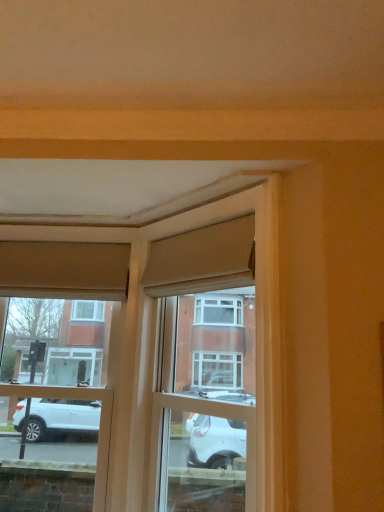
Question: Is matte wood window frame at center a part of matte glass window at center?

Choices:
 (A) yes
 (B) no

Answer: (B)

Question: Considering the relative sizes of matte glass window at center and matte wood window frame at center in the image provided, is matte glass window at center thinner than matte wood window frame at center?

Choices:
 (A) yes
 (B) no

Answer: (A)

Question: Is matte glass window at center touching matte wood window frame at center?

Choices:
 (A) no
 (B) yes

Answer: (A)

Question: Can you confirm if matte glass window at center is taller than matte wood window frame at center?

Choices:
 (A) no
 (B) yes

Answer: (B)

Question: Are matte glass window at center and matte wood window frame at center located far from each other?

Choices:
 (A) no
 (B) yes

Answer: (A)

Question: From the image's perspective, does matte glass window at center appear higher than matte wood window frame at center?

Choices:
 (A) no
 (B) yes

Answer: (A)

Question: Is matte wood window frame at center bigger than matte beige curtain at upper center, which is counted as the second curtain, starting from the back?

Choices:
 (A) no
 (B) yes

Answer: (B)

Question: From a real-world perspective, is matte wood window frame at center under matte beige curtain at upper center, which is counted as the second curtain, starting from the back?

Choices:
 (A) yes
 (B) no

Answer: (A)

Question: Is matte wood window frame at center outside matte beige curtain at upper center, the first curtain positioned from the right?

Choices:
 (A) yes
 (B) no

Answer: (A)

Question: Does matte wood window frame at center have a greater width compared to matte beige curtain at upper center, the second curtain in the left-to-right sequence?

Choices:
 (A) no
 (B) yes

Answer: (B)

Question: Does matte wood window frame at center turn towards matte beige curtain at upper center, which is counted as the second curtain, starting from the back?

Choices:
 (A) yes
 (B) no

Answer: (A)

Question: Is matte wood window frame at center next to matte beige curtain at upper center, which is counted as the second curtain, starting from the back?

Choices:
 (A) yes
 (B) no

Answer: (B)

Question: Is matte beige curtain at upper center, the second curtain in the left-to-right sequence, aimed at matte beige curtain at upper left, marked as the 2th curtain in a front-to-back arrangement?

Choices:
 (A) no
 (B) yes

Answer: (A)